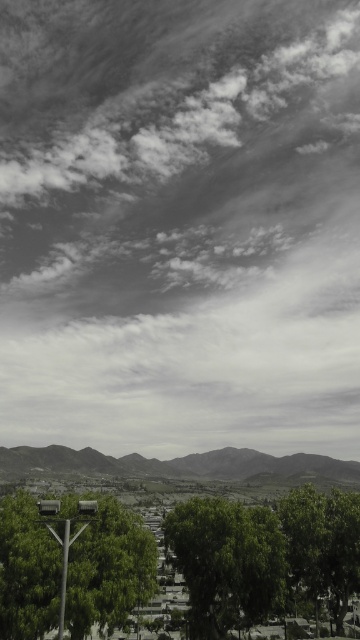
Between white fluffy cloud at upper center and green leafy tree at lower right, which one appears on the left side from the viewer's perspective?

From the viewer's perspective, white fluffy cloud at upper center appears more on the left side.

Measure the distance between white fluffy cloud at upper center and green leafy tree at lower right.

A distance of 339.17 meters exists between white fluffy cloud at upper center and green leafy tree at lower right.

Locate an element on the screen. Image resolution: width=360 pixels, height=640 pixels. white fluffy cloud at upper center is located at coordinates point(180,225).

Identify the location of white fluffy cloud at upper center. (180, 225).

Is white fluffy cloud at upper center positioned behind green leafy tree at center?

Yes, it is behind green leafy tree at center.

Where is `white fluffy cloud at upper center`? Image resolution: width=360 pixels, height=640 pixels. white fluffy cloud at upper center is located at coordinates (180, 225).

Between point (15, 404) and point (254, 592), which one is positioned in front?

Point (254, 592) is more forward.

The height and width of the screenshot is (640, 360). Find the location of `white fluffy cloud at upper center`. white fluffy cloud at upper center is located at coordinates (180, 225).

Can you confirm if green leafy tree at center is bigger than green leafy tree at lower right?

Incorrect, green leafy tree at center is not larger than green leafy tree at lower right.

Can you confirm if green leafy tree at center is positioned to the right of green leafy tree at lower right?

No, green leafy tree at center is not to the right of green leafy tree at lower right.

Measure the distance between green leafy tree at center and camera.

green leafy tree at center is 40.35 meters away from camera.

The height and width of the screenshot is (640, 360). I want to click on green leafy tree at center, so click(x=227, y=563).